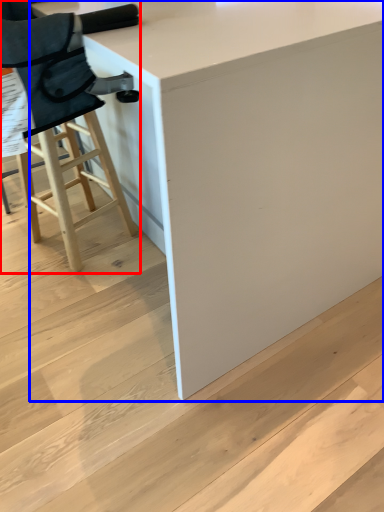
Question: Which of the following is the farthest to the observer, chair (highlighted by a red box) or table (highlighted by a blue box)?

Choices:
 (A) chair
 (B) table

Answer: (A)